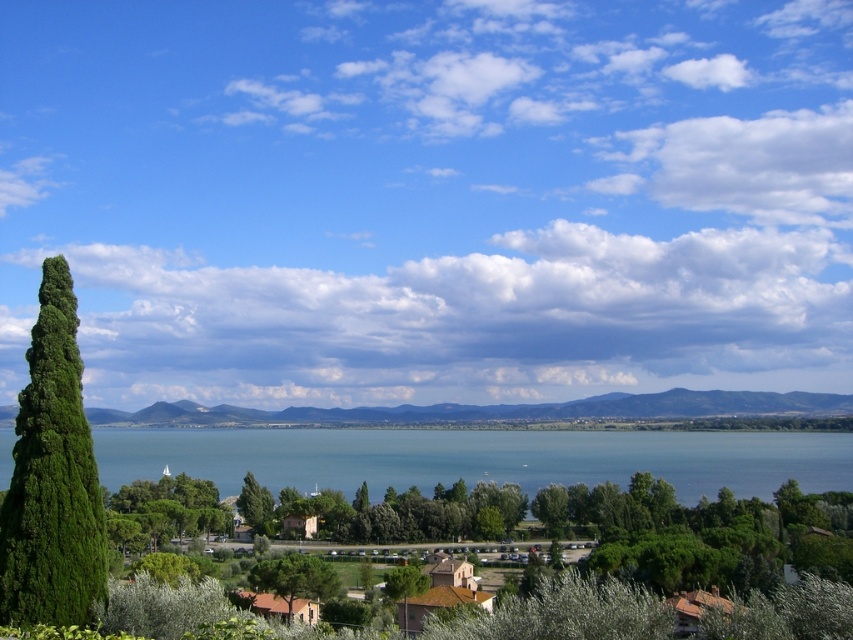
Does blue water at center lie behind green leafy cypress at left?

No, blue water at center is closer to the viewer.

Locate an element on the screen. This screenshot has width=853, height=640. blue water at center is located at coordinates click(479, 458).

At what (x,y) coordinates should I click in order to perform the action: click on blue water at center. Please return your answer as a coordinate pair (x, y). This screenshot has width=853, height=640. Looking at the image, I should click on (479, 458).